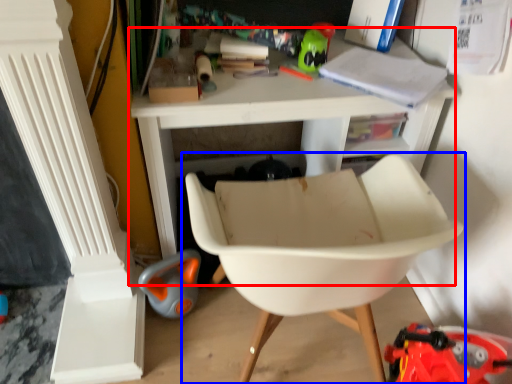
Question: Which point is further to the camera, table (highlighted by a red box) or chair (highlighted by a blue box)?

Choices:
 (A) table
 (B) chair

Answer: (A)